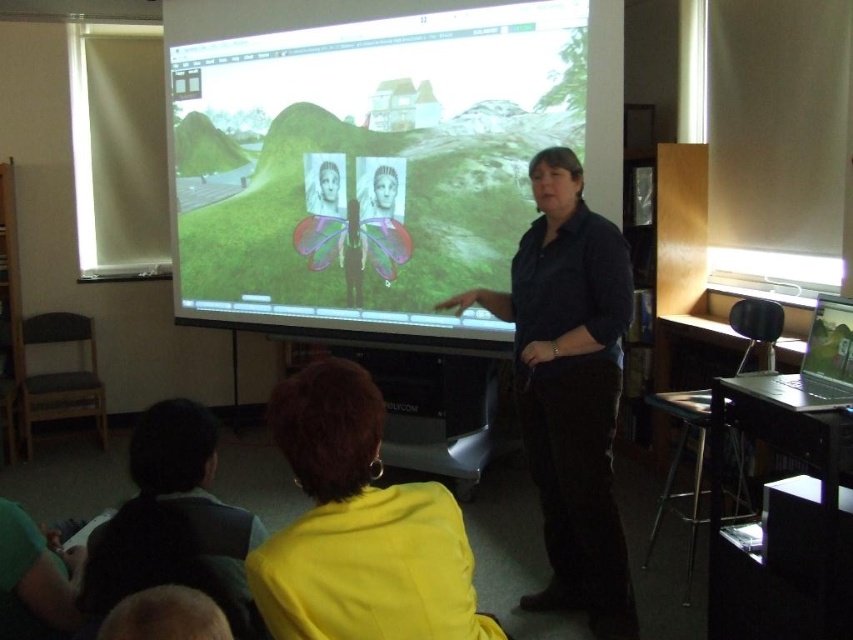
Does dark blue shirt at center have a lesser height compared to yellow fabric at lower center?

No, dark blue shirt at center is not shorter than yellow fabric at lower center.

Based on the photo, is dark blue shirt at center wider than yellow fabric at lower center?

Correct, the width of dark blue shirt at center exceeds that of yellow fabric at lower center.

Where is `dark blue shirt at center`? The width and height of the screenshot is (853, 640). dark blue shirt at center is located at coordinates (570, 388).

In order to click on dark blue shirt at center in this screenshot , I will do `click(570, 388)`.

What do you see at coordinates (366, 163) in the screenshot? I see `matte white screen at center` at bounding box center [366, 163].

Which is more to the right, matte white screen at center or yellow fabric at lower center?

Positioned to the right is yellow fabric at lower center.

Measure the distance between matte white screen at center and camera.

A distance of 10.80 feet exists between matte white screen at center and camera.

Where is `matte white screen at center`? The image size is (853, 640). matte white screen at center is located at coordinates (366, 163).

Is matte white screen at center shorter than dark blue shirt at center?

In fact, matte white screen at center may be taller than dark blue shirt at center.

Between matte white screen at center and dark blue shirt at center, which one is positioned higher?

matte white screen at center

This screenshot has width=853, height=640. Identify the location of matte white screen at center. (366, 163).

Identify the location of matte white screen at center. The image size is (853, 640). (366, 163).